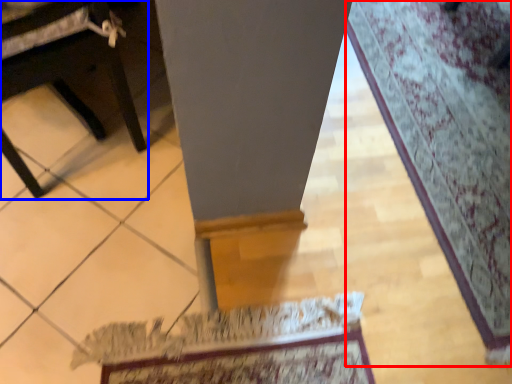
Question: Among these objects, which one is nearest to the camera, mat (highlighted by a red box) or furniture (highlighted by a blue box)?

Choices:
 (A) mat
 (B) furniture

Answer: (B)